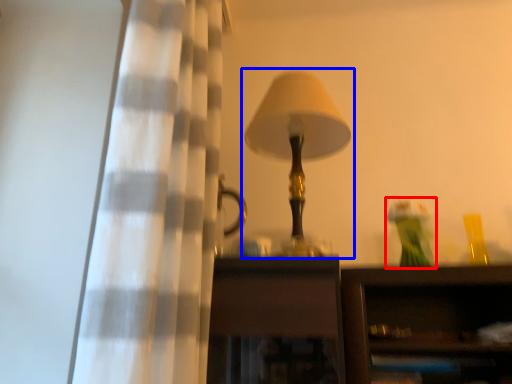
Question: Which point is closer to the camera, toy (highlighted by a red box) or lamp (highlighted by a blue box)?

Choices:
 (A) toy
 (B) lamp

Answer: (B)